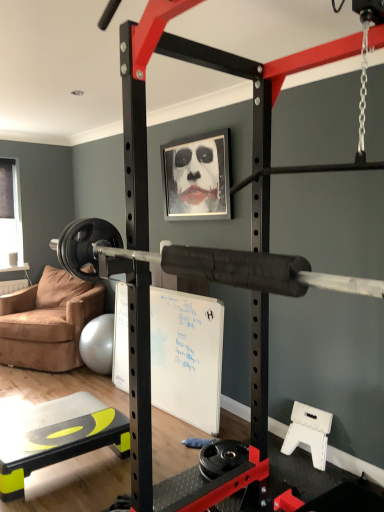
Question: Is yellow-green plastic step at lower left completely or partially outside of brown suede chair at left?

Choices:
 (A) no
 (B) yes

Answer: (B)

Question: Can you confirm if yellow-green plastic step at lower left is shorter than brown suede chair at left?

Choices:
 (A) yes
 (B) no

Answer: (A)

Question: Does yellow-green plastic step at lower left come behind brown suede chair at left?

Choices:
 (A) yes
 (B) no

Answer: (B)

Question: Is yellow-green plastic step at lower left not close to brown suede chair at left?

Choices:
 (A) yes
 (B) no

Answer: (A)

Question: Considering the relative sizes of yellow-green plastic step at lower left and brown suede chair at left in the image provided, is yellow-green plastic step at lower left bigger than brown suede chair at left?

Choices:
 (A) no
 (B) yes

Answer: (A)

Question: Is brown suede chair at left wider or thinner than transparent plastic window screen at left?

Choices:
 (A) wide
 (B) thin

Answer: (A)

Question: Looking at the image, does brown suede chair at left seem bigger or smaller compared to transparent plastic window screen at left?

Choices:
 (A) small
 (B) big

Answer: (B)

Question: Is brown suede chair at left to the left or to the right of transparent plastic window screen at left in the image?

Choices:
 (A) left
 (B) right

Answer: (B)

Question: From a real-world perspective, is brown suede chair at left positioned above or below transparent plastic window screen at left?

Choices:
 (A) below
 (B) above

Answer: (A)

Question: Is transparent plastic window screen at left inside or outside of brown suede chair at left?

Choices:
 (A) outside
 (B) inside

Answer: (A)

Question: From a real-world perspective, is transparent plastic window screen at left physically located above or below brown suede chair at left?

Choices:
 (A) below
 (B) above

Answer: (B)

Question: Is transparent plastic window screen at left taller or shorter than brown suede chair at left?

Choices:
 (A) tall
 (B) short

Answer: (A)

Question: Relative to brown suede chair at left, is transparent plastic window screen at left in front or behind?

Choices:
 (A) front
 (B) behind

Answer: (B)

Question: In the image, is yellow-green plastic step at lower left positioned in front of or behind metallic silver picture frame at upper center?

Choices:
 (A) behind
 (B) front

Answer: (B)

Question: In terms of width, does yellow-green plastic step at lower left look wider or thinner when compared to metallic silver picture frame at upper center?

Choices:
 (A) wide
 (B) thin

Answer: (A)